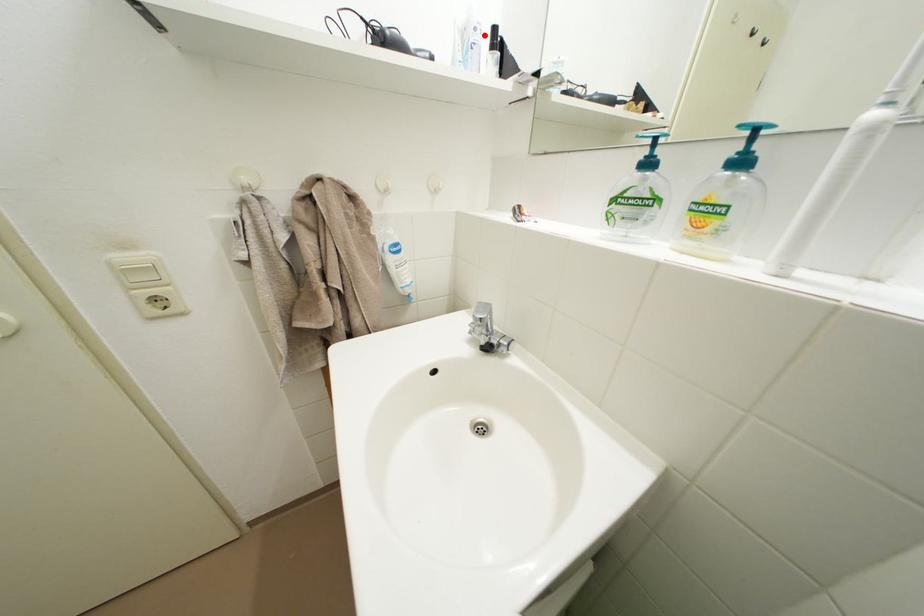
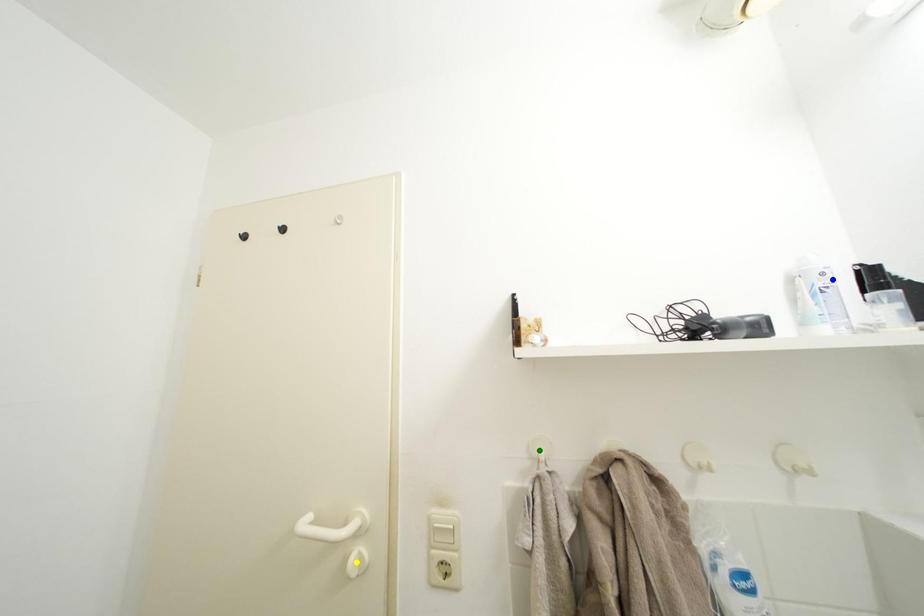
Question: I am providing you with two images of the same scene from different viewpoints. A red point is marked on the first image. You are given multiple points on the second image. Which point in image 2 represents the same 3d spot as the red point in image 1?

Choices:
 (A) green point
 (B) yellow point
 (C) blue point

Answer: (C)